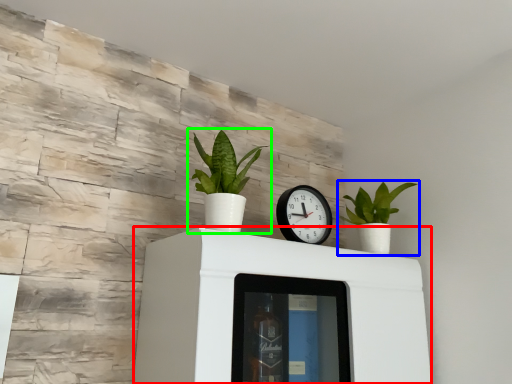
Question: Which object is positioned closest to furniture (highlighted by a red box)? Select from houseplant (highlighted by a blue box) and houseplant (highlighted by a green box).

Choices:
 (A) houseplant
 (B) houseplant

Answer: (B)